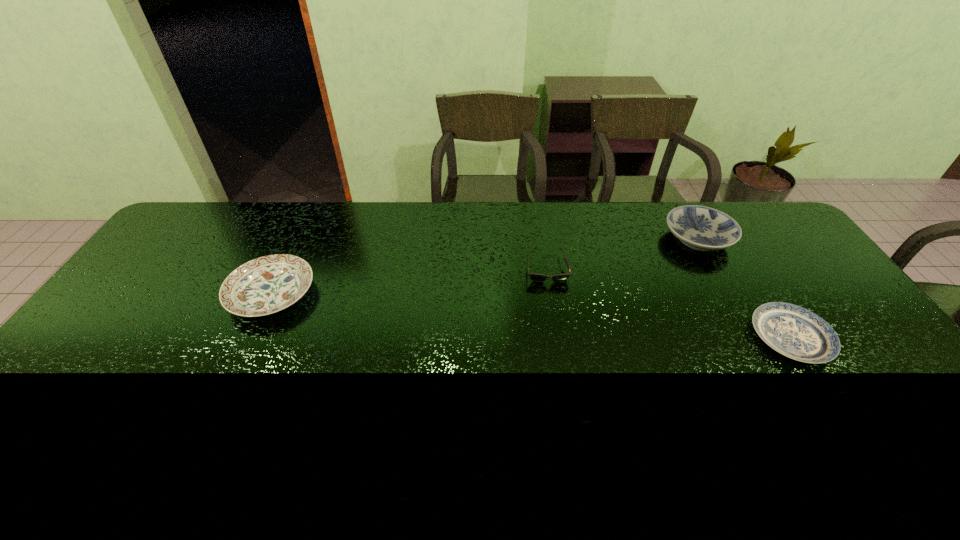
You are a GUI agent. You are given a task and a screenshot of the screen. Output one action in this format:
    pyautogui.click(x=<x>, y=<y>)
    Task: Click on the object that ranks as the closest to the third object from right to left
    This screenshot has width=960, height=540.
    Given the screenshot: What is the action you would take?
    click(x=701, y=228)

Select which object appears as the second closest to the tallest plate. Please provide its 2D coordinates. Your answer should be formatted as a tuple, i.e. [(x, y)], where the tuple contains the x and y coordinates of a point satisfying the conditions above.

[(535, 277)]

I want to click on the closest plate to the shortest plate, so click(x=701, y=228).

The width and height of the screenshot is (960, 540). I want to click on plate identified as the second closest to the farthest plate, so click(x=265, y=285).

You are a GUI agent. You are given a task and a screenshot of the screen. Output one action in this format:
    pyautogui.click(x=<x>, y=<y>)
    Task: Click on the free region that satisfies the following two spatial constraints: 1. on the back side of the tallest plate; 2. on the right side of the second tallest plate
    
    Given the screenshot: What is the action you would take?
    pyautogui.click(x=298, y=239)

You are a GUI agent. You are given a task and a screenshot of the screen. Output one action in this format:
    pyautogui.click(x=<x>, y=<y>)
    Task: Click on the free location that satisfies the following two spatial constraints: 1. on the front side of the shortest plate; 2. on the left side of the tallest object
    Image resolution: width=960 pixels, height=540 pixels.
    Given the screenshot: What is the action you would take?
    pyautogui.click(x=754, y=338)